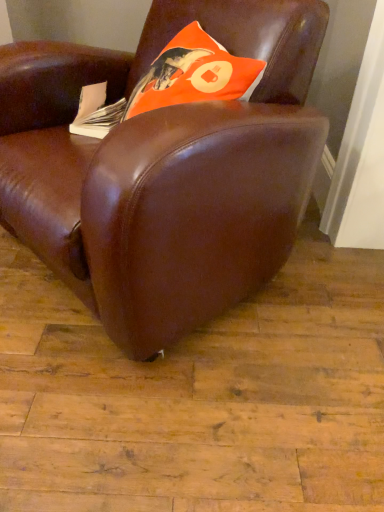
This screenshot has width=384, height=512. What are the coordinates of `orange matte pillow at upper center` in the screenshot? It's located at (194, 74).

Image resolution: width=384 pixels, height=512 pixels. What do you see at coordinates (96, 112) in the screenshot?
I see `white paper at left` at bounding box center [96, 112].

Locate an element on the screen. The height and width of the screenshot is (512, 384). orange matte pillow at upper center is located at coordinates (194, 74).

Which is behind, point (236, 89) or point (105, 95)?

The point (105, 95) is more distant.

Considering the sizes of objects orange matte pillow at upper center and white paper at left in the image provided, who is smaller, orange matte pillow at upper center or white paper at left?

white paper at left.

Where is `paperback book on the left of orange matte pillow at upper center`? paperback book on the left of orange matte pillow at upper center is located at coordinates (96, 112).

Measure the distance from orange matte pillow at upper center to white paper at left.

orange matte pillow at upper center and white paper at left are 23.49 centimeters apart.

Does point (202, 69) come farther from viewer compared to point (85, 261)?

Yes, point (202, 69) is farther from viewer.

From the image's perspective, is orange matte pillow at upper center above or below brown leather chair at center?

Based on their image positions, orange matte pillow at upper center is located above brown leather chair at center.

Measure the distance between orange matte pillow at upper center and brown leather chair at center.

The distance of orange matte pillow at upper center from brown leather chair at center is 9.91 inches.

Considering the sizes of orange matte pillow at upper center and brown leather chair at center in the image, is orange matte pillow at upper center bigger or smaller than brown leather chair at center?

In the image, orange matte pillow at upper center appears to be smaller than brown leather chair at center.

From the image's perspective, is white paper at left located above or below orange matte pillow at upper center?

white paper at left is situated lower than orange matte pillow at upper center in the image.

Does white paper at left turn towards orange matte pillow at upper center?

No, white paper at left is not aimed at orange matte pillow at upper center.

You are a GUI agent. You are given a task and a screenshot of the screen. Output one action in this format:
    pyautogui.click(x=<x>, y=<y>)
    Task: Click on the paperback book behind the orange matte pillow at upper center
    This screenshot has width=384, height=512.
    Given the screenshot: What is the action you would take?
    pyautogui.click(x=96, y=112)

Choose the correct answer: Is white paper at left inside orange matte pillow at upper center or outside it?

white paper at left cannot be found inside orange matte pillow at upper center.

Is white paper at left facing towards brown leather chair at center?

Yes, white paper at left is facing brown leather chair at center.

Is white paper at left inside or outside of brown leather chair at center?

white paper at left is inside brown leather chair at center.

Is white paper at left beside brown leather chair at center?

No, white paper at left is not making contact with brown leather chair at center.

Visually, is white paper at left positioned to the left or to the right of brown leather chair at center?

white paper at left is positioned on brown leather chair at center's left side.

Between brown leather chair at center and orange matte pillow at upper center, which one appears on the right side from the viewer's perspective?

orange matte pillow at upper center.

Looking at their sizes, would you say brown leather chair at center is wider or thinner than orange matte pillow at upper center?

In the image, brown leather chair at center appears to be wider than orange matte pillow at upper center.

Considering the positions of objects brown leather chair at center and orange matte pillow at upper center in the image provided, who is in front, brown leather chair at center or orange matte pillow at upper center?

brown leather chair at center.

Locate an element on the screen. chair located in front of the orange matte pillow at upper center is located at coordinates (164, 170).

From the image's perspective, would you say brown leather chair at center is shown under white paper at left?

Yes, from the image's perspective, brown leather chair at center is beneath white paper at left.

Is brown leather chair at center looking in the opposite direction of white paper at left?

Yes.

Find the location of `chair that is in front of the white paper at left`. chair that is in front of the white paper at left is located at coordinates (164, 170).

Find the location of a particular element. This screenshot has width=384, height=512. paperback book below the orange matte pillow at upper center (from a real-world perspective) is located at coordinates (96, 112).

Locate an element on the screen. Image resolution: width=384 pixels, height=512 pixels. throw pillow on the right of the brown leather chair at center is located at coordinates (194, 74).

Considering their positions, is brown leather chair at center positioned closer to orange matte pillow at upper center than white paper at left?

white paper at left lies closer to orange matte pillow at upper center than the other object.

Estimate the real-world distances between objects in this image. Which object is closer to white paper at left, brown leather chair at center or orange matte pillow at upper center?

orange matte pillow at upper center is positioned closer to the anchor white paper at left.

Based on their spatial positions, is orange matte pillow at upper center or brown leather chair at center further from white paper at left?

brown leather chair at center is further to white paper at left.

Based on their spatial positions, is orange matte pillow at upper center or white paper at left closer to brown leather chair at center?

orange matte pillow at upper center is closer to brown leather chair at center.

Consider the image. Estimate the real-world distances between objects in this image. Which object is further from brown leather chair at center, white paper at left or orange matte pillow at upper center?

white paper at left is positioned further to the anchor brown leather chair at center.

Considering their positions, is white paper at left positioned further to orange matte pillow at upper center than brown leather chair at center?

brown leather chair at center lies further to orange matte pillow at upper center than the other object.

Locate an element on the screen. throw pillow between brown leather chair at center and white paper at left from front to back is located at coordinates (194, 74).